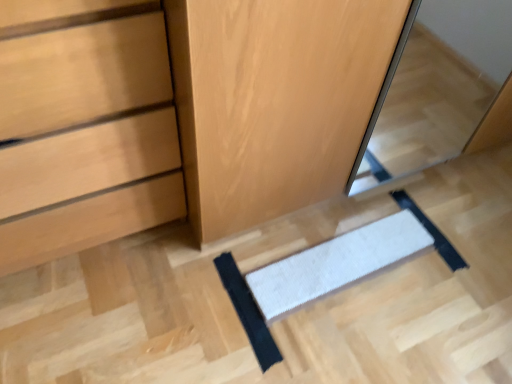
Question: Visually, is matte wood chest of drawers at lower left positioned to the left or to the right of white textured mat at center, the 2th doormat viewed from the right?

Choices:
 (A) left
 (B) right

Answer: (A)

Question: Is matte wood chest of drawers at lower left in front of or behind white textured mat at center, the 1th doormat viewed from the left, in the image?

Choices:
 (A) front
 (B) behind

Answer: (A)

Question: Estimate the real-world distances between objects in this image. Which object is farther from the white textured mat at center, placed as the second doormat when sorted from left to right?

Choices:
 (A) matte wood chest of drawers at lower left
 (B) wooden dresser at center
 (C) white textured mat at center, the 2th doormat viewed from the right

Answer: (A)

Question: Which of these objects is positioned farthest from the wooden dresser at center?

Choices:
 (A) white textured mat at center, placed as the 1th doormat when sorted from right to left
 (B) white textured mat at center, the 2th doormat viewed from the right
 (C) matte wood chest of drawers at lower left

Answer: (B)